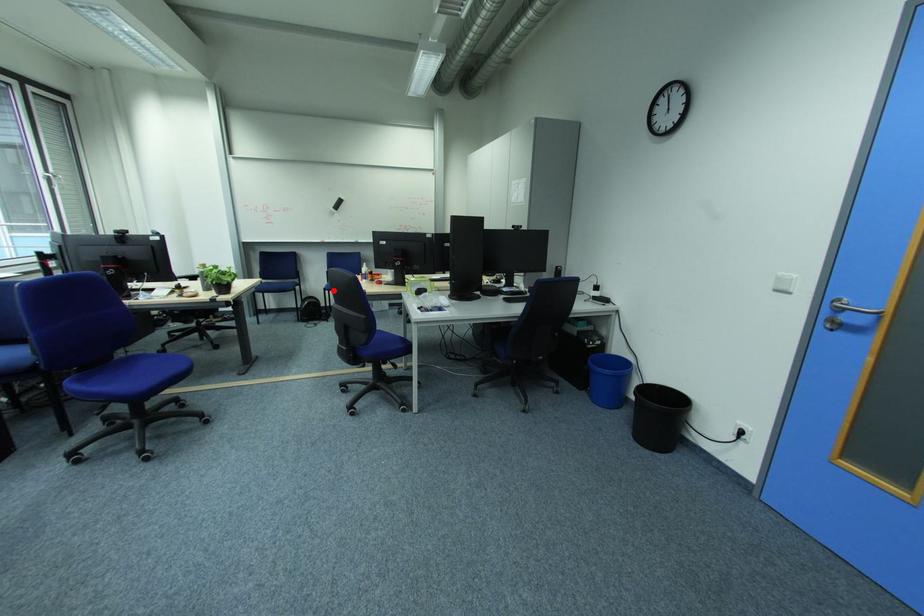
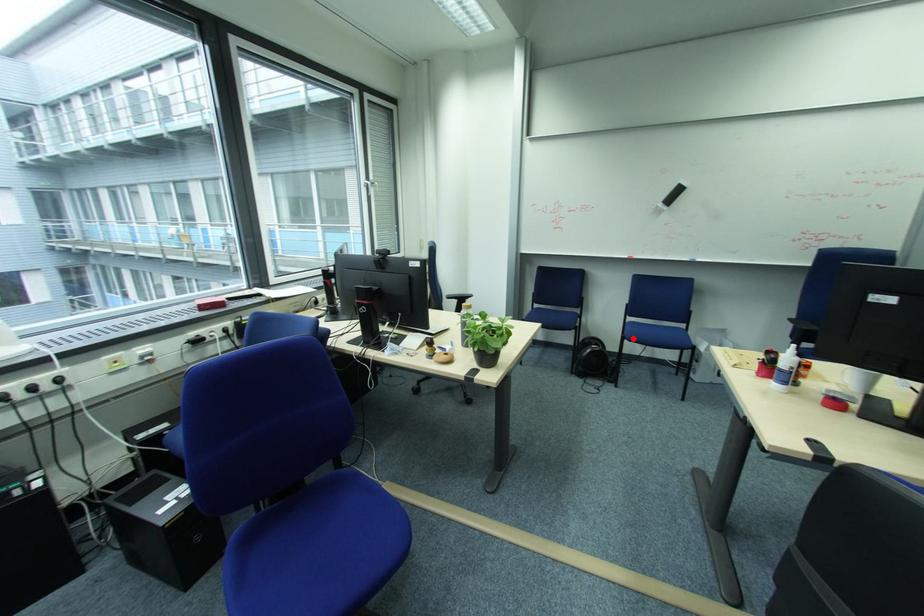
I am providing you with two images of the same scene from different viewpoints. A red point is marked on the first image and another point is marked on the second image. Is the marked point in image1 the same physical position as the marked point in image2?

Yes